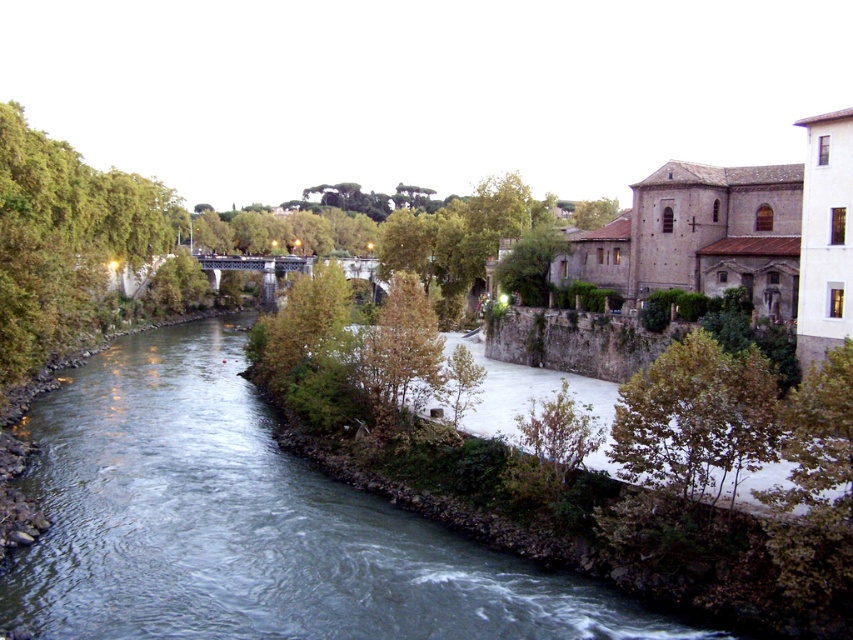
Question: Which of the following is the farthest from the observer?

Choices:
 (A) green leafy tree at left
 (B) green leafy tree at lower right

Answer: (A)

Question: Is green leafy tree at left below green matte tree at center?

Choices:
 (A) yes
 (B) no

Answer: (B)

Question: Can you confirm if green leafy tree at left is thinner than green leafy tree at lower right?

Choices:
 (A) yes
 (B) no

Answer: (B)

Question: Is green leafy tree at lower right positioned in front of green matte tree at center?

Choices:
 (A) no
 (B) yes

Answer: (B)

Question: Estimate the real-world distances between objects in this image. Which object is farther from the green leafy tree at lower right?

Choices:
 (A) clear water at center
 (B) green leafy tree at left

Answer: (B)

Question: Which point appears farthest from the camera in this image?

Choices:
 (A) (120, 262)
 (B) (198, 531)
 (C) (415, 321)
 (D) (654, 474)

Answer: (A)